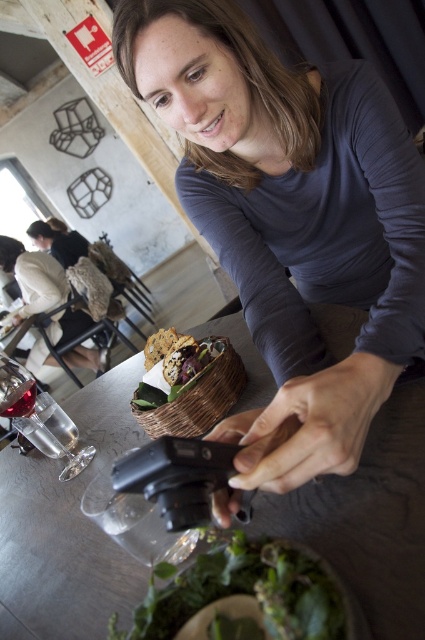
Question: Can you confirm if matte black camera at center is bigger than smooth wooden table at center?

Choices:
 (A) yes
 (B) no

Answer: (B)

Question: Which is farther from the green leafy salad at lower center?

Choices:
 (A) matte black camera at center
 (B) brown woven basket at center

Answer: (A)

Question: Estimate the real-world distances between objects in this image. Which object is farther from the clear glass wine glass at lower left?

Choices:
 (A) brown woven basket at center
 (B) white fur coat at upper left

Answer: (B)

Question: Is matte black camera at center below translucent glass wine glass at lower left?

Choices:
 (A) no
 (B) yes

Answer: (A)

Question: Among these points, which one is farthest from the camera?

Choices:
 (A) (396, 614)
 (B) (368, 170)
 (C) (68, 477)

Answer: (C)

Question: Is smooth wooden table at center behind white fur coat at upper left?

Choices:
 (A) no
 (B) yes

Answer: (A)